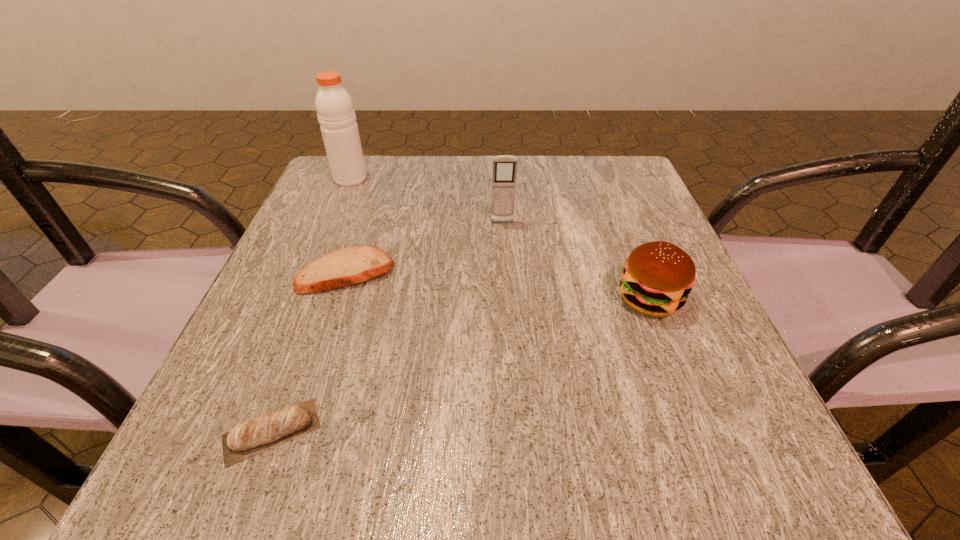
Locate an element on the screen. The image size is (960, 540). blank space at the near edge of the desktop is located at coordinates (352, 475).

This screenshot has width=960, height=540. Find the location of `free space at the left edge of the desktop`. free space at the left edge of the desktop is located at coordinates (355, 216).

Find the location of `vacant space at the right edge of the desktop`. vacant space at the right edge of the desktop is located at coordinates (602, 242).

In the image, there is a desktop. Identify the location of vacant space at the near right corner. (760, 456).

Identify the location of free space between the second farthest object and the rightmost object. This screenshot has height=540, width=960. (576, 261).

Locate an element on the screen. This screenshot has height=540, width=960. empty space that is in between the farther pita bread and the third shortest object is located at coordinates (498, 286).

Locate an element on the screen. The height and width of the screenshot is (540, 960). vacant area that lies between the nearest object and the farthest object is located at coordinates (311, 305).

Locate an element on the screen. This screenshot has width=960, height=540. unoccupied position between the second tallest object and the farther pita bread is located at coordinates (424, 248).

The image size is (960, 540). In order to click on empty location between the second farthest object and the farther pita bread in this screenshot , I will do `click(424, 248)`.

The width and height of the screenshot is (960, 540). Identify the location of unoccupied position between the farther pita bread and the farthest object. (348, 226).